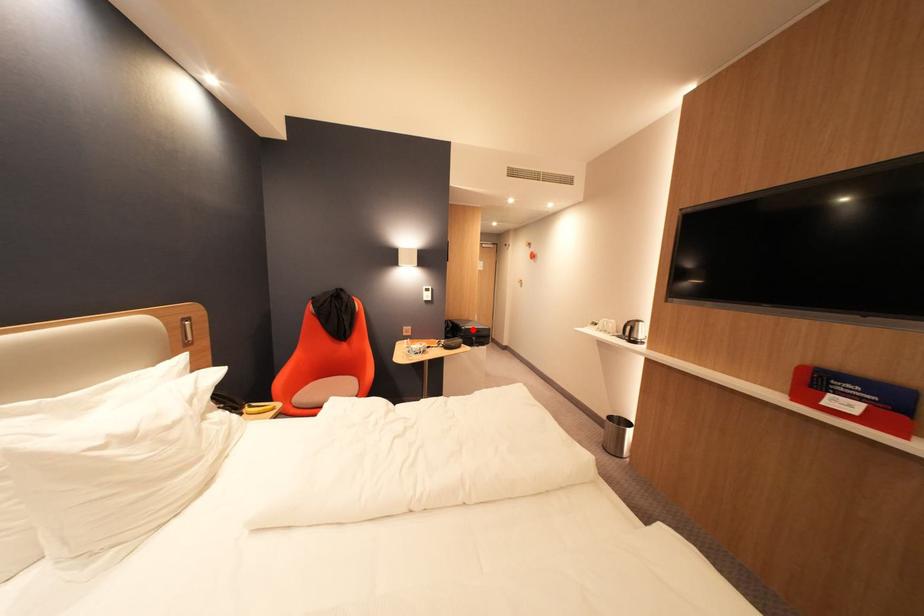
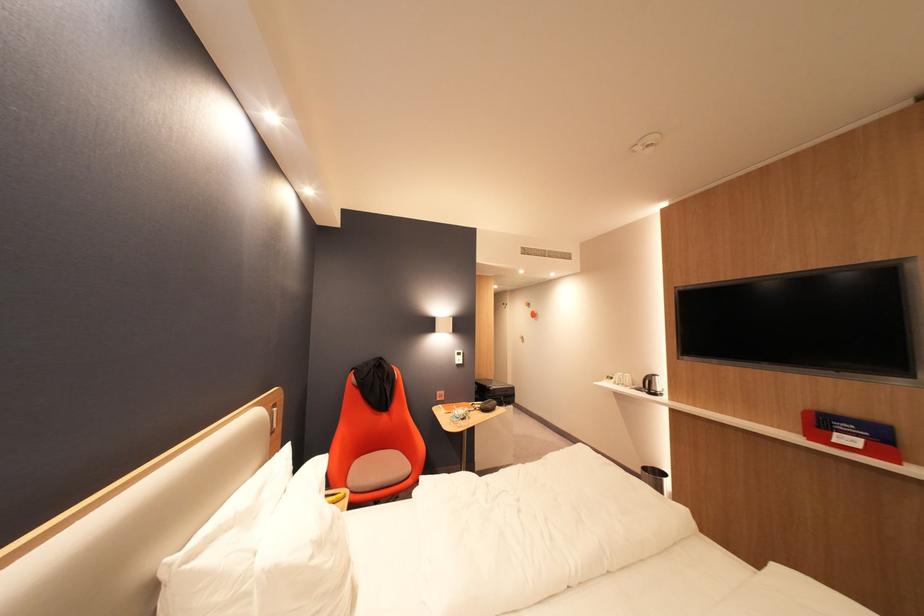
In the second image, find the point that corresponds to the highlighted location in the first image.

(502, 390)